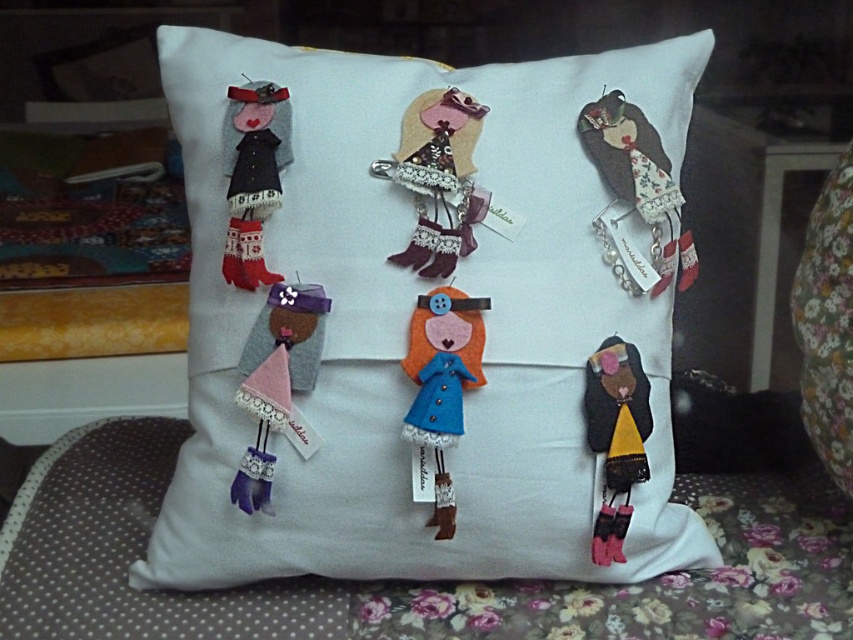
You are a toy organizer trying to place a new doll on the white felt pillow at center. The new doll is as wide as the brown felt doll at upper right. Will the new doll fit on the pillow?

The white felt pillow at center might be wider than brown felt doll at upper right, so the new doll should fit as long as the pillow has enough space.

You are looking at the white felt pillow at center and the brown felt doll at upper right. Which object is nearer to you?

Answer: The white felt pillow at center is closer to the viewer than the brown felt doll at upper right.

You are trying to place a new felt doll between the pink felt doll at center and the dark brown felt doll at lower right. Based on their widths, which doll should you consider moving to make space?

The pink felt doll at center might be wider than dark brown felt doll at lower right, so you should consider moving the pink felt doll at center to make space for the new doll.